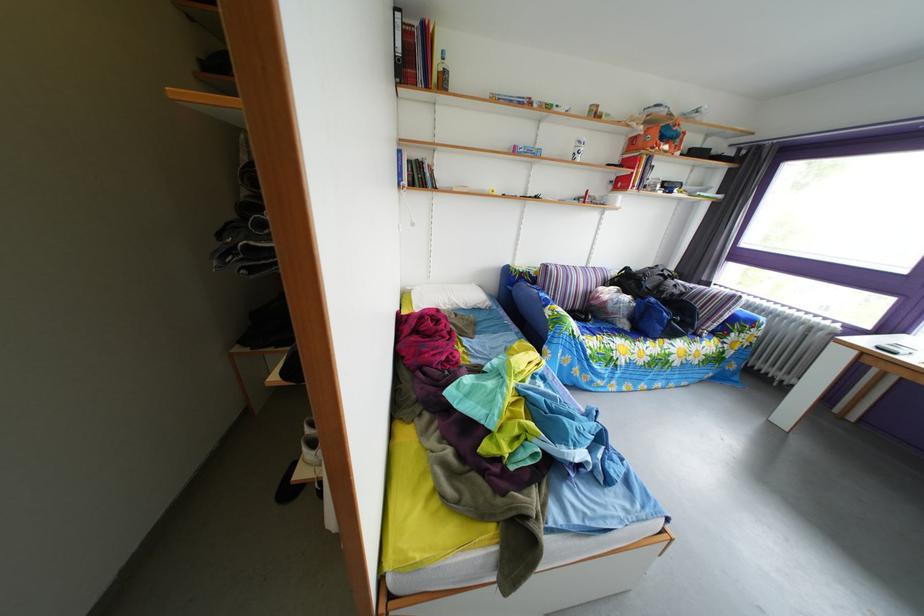
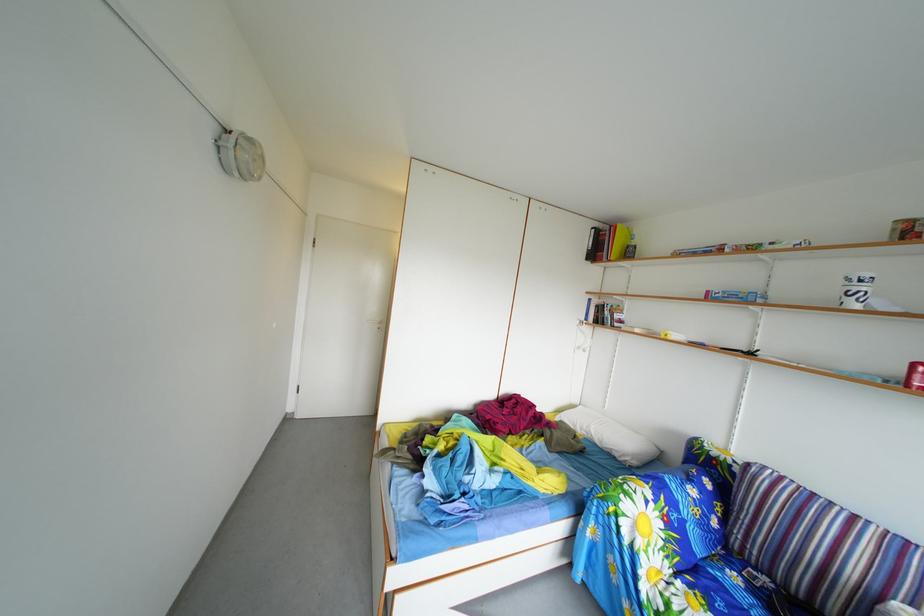
Locate, in the second image, the point that corresponds to (477,314) in the first image.

(612, 451)